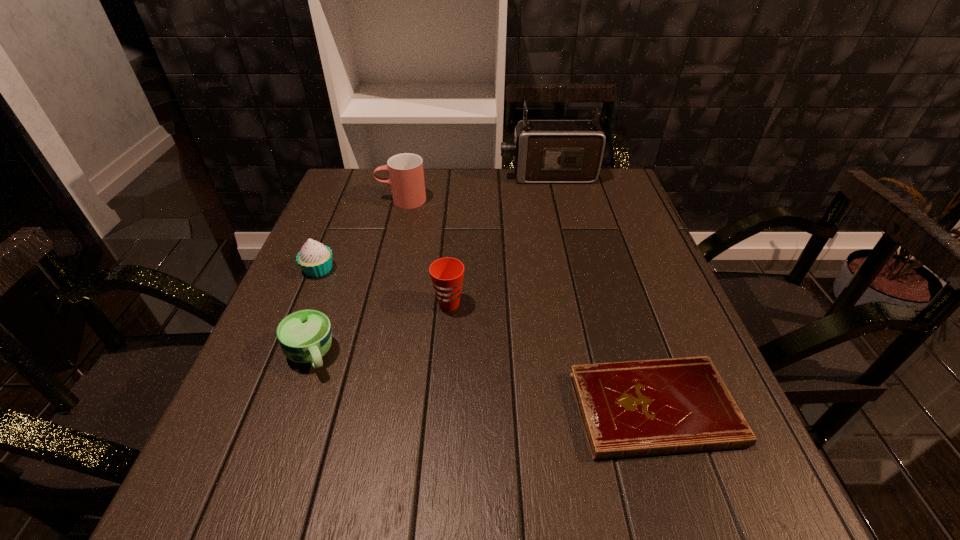
Where is `cup positioned at the far edge`? cup positioned at the far edge is located at coordinates [406, 175].

Where is `cupcake present at the left edge`? This screenshot has width=960, height=540. cupcake present at the left edge is located at coordinates (315, 259).

At what (x,y) coordinates should I click in order to perform the action: click on camcorder situated at the right edge. Please return your answer as a coordinate pair (x, y). Looking at the image, I should click on (544, 151).

Identify the location of notebook present at the right edge. (665, 406).

The height and width of the screenshot is (540, 960). I want to click on object at the far left corner, so click(x=406, y=175).

Where is `object that is at the far right corner`? object that is at the far right corner is located at coordinates (544, 151).

The width and height of the screenshot is (960, 540). I want to click on vacant space at the far edge of the desktop, so click(497, 204).

You are a GUI agent. You are given a task and a screenshot of the screen. Output one action in this format:
    pyautogui.click(x=<x>, y=<y>)
    Task: Click on the blank space at the left edge
    The image size is (960, 540).
    Given the screenshot: What is the action you would take?
    pyautogui.click(x=322, y=237)

What are the coordinates of `free space at the right edge` in the screenshot? It's located at (649, 235).

The width and height of the screenshot is (960, 540). In the image, there is a desktop. In order to click on free region at the far left corner in this screenshot , I will do `click(374, 173)`.